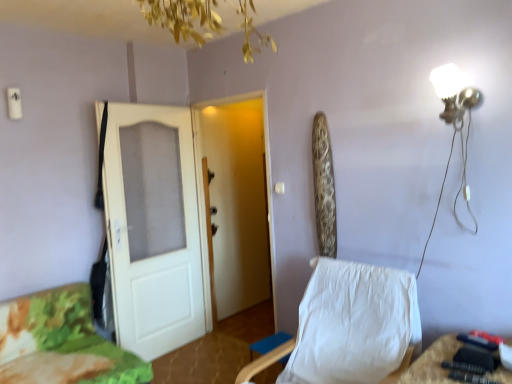
Question: Is white glossy wall lamp at upper right in front of or behind camouflage fabric bed at lower left in the image?

Choices:
 (A) front
 (B) behind

Answer: (A)

Question: From a real-world perspective, is white glossy wall lamp at upper right positioned above or below camouflage fabric bed at lower left?

Choices:
 (A) below
 (B) above

Answer: (B)

Question: Which object is positioned closest to the camouflage fabric bed at lower left?

Choices:
 (A) white wooden door at center, arranged as the 2th door when viewed from the left
 (B) white glossy wall lamp at upper right
 (C) white fabric chair at center
 (D) white matte door at left, which appears as the 1th door when viewed from the left

Answer: (D)

Question: Considering the real-world distances, which object is closest to the camouflage fabric bed at lower left?

Choices:
 (A) white matte door at left, arranged as the 2th door when viewed from the right
 (B) white wooden door at center, arranged as the 2th door when viewed from the left
 (C) white fabric chair at center
 (D) white glossy wall lamp at upper right

Answer: (A)